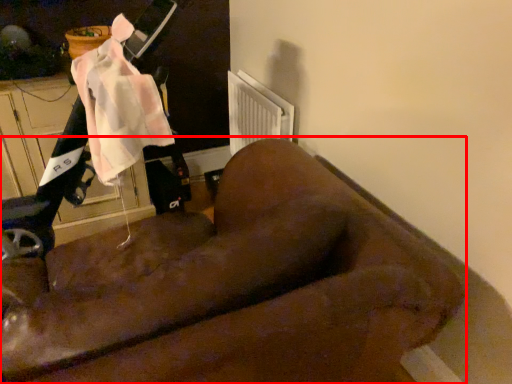
Question: Where is furniture (annotated by the red box) located in relation to mobility scooter in the image?

Choices:
 (A) left
 (B) right

Answer: (B)